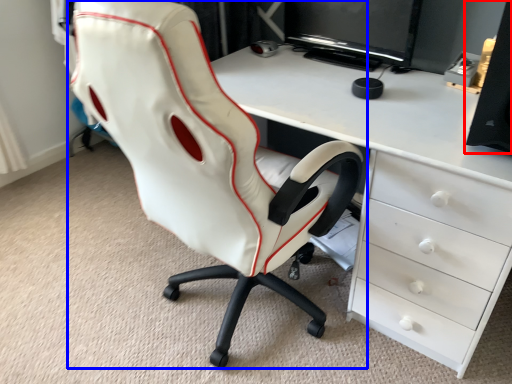
Question: Among these objects, which one is nearest to the camera, speaker (highlighted by a red box) or chair (highlighted by a blue box)?

Choices:
 (A) speaker
 (B) chair

Answer: (B)